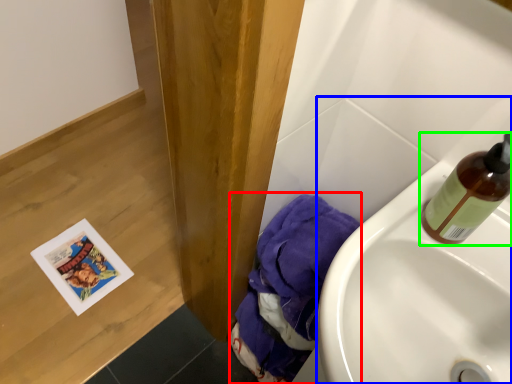
Question: Which object is positioned closest to material (highlighted by a red box)? Select from sink (highlighted by a blue box) and bottle (highlighted by a green box).

Choices:
 (A) sink
 (B) bottle

Answer: (A)